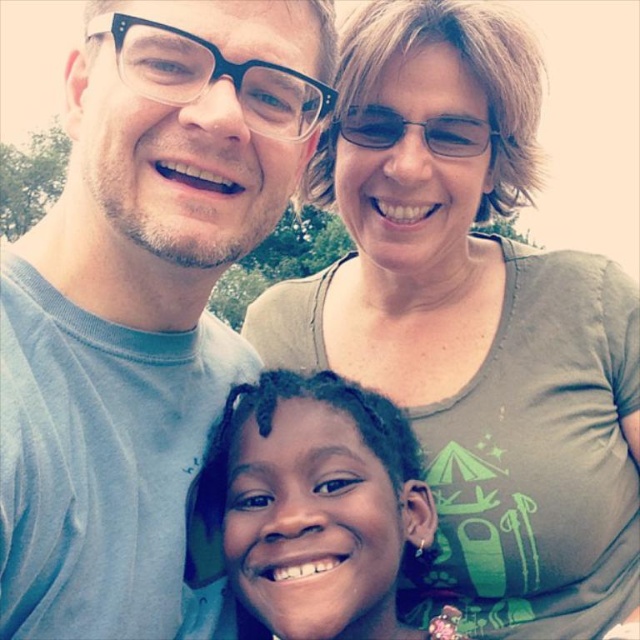
You are taking a photo of the group and need to adjust your camera focus. Which object should you focus on first if you want to ensure the green matte shirt at upper center and the clear plastic glasses at upper center are both in sharp focus?

The clear plastic glasses at upper center should be focused on first because the green matte shirt at upper center is located below it, so focusing on the higher object ensures both are in focus.